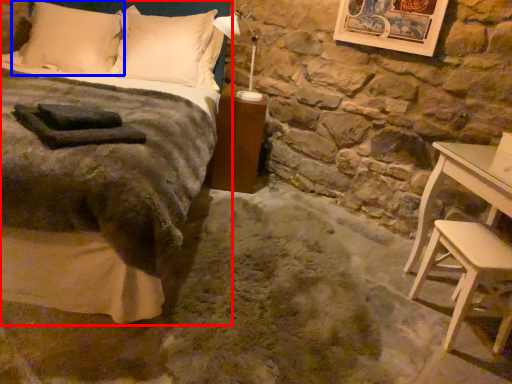
Question: Which object appears farthest to the camera in this image, bed (highlighted by a red box) or pillow (highlighted by a blue box)?

Choices:
 (A) bed
 (B) pillow

Answer: (B)